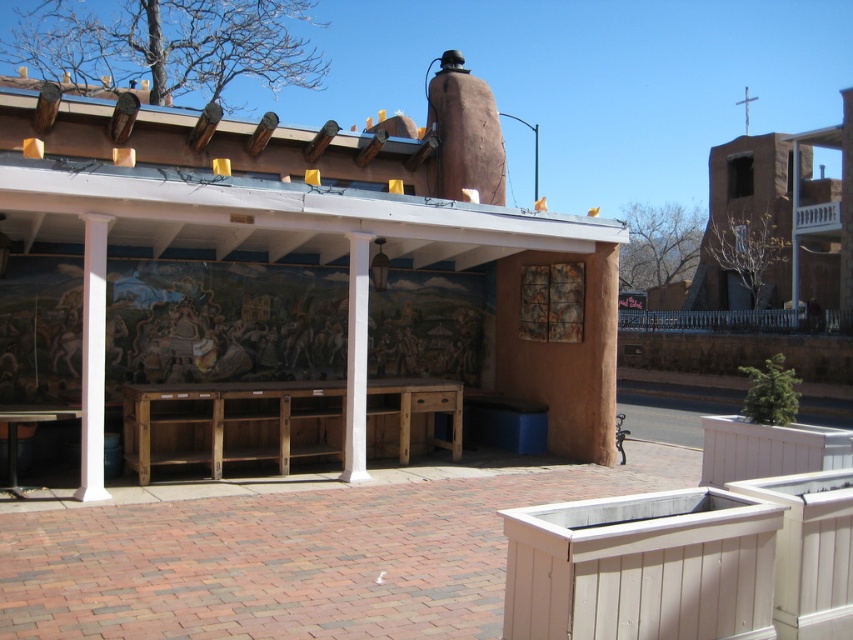
Is wooden bench at center to the right of wooden picnic table at lower left from the viewer's perspective?

Yes, wooden bench at center is to the right of wooden picnic table at lower left.

Which of these two, wooden bench at center or wooden picnic table at lower left, stands taller?

wooden picnic table at lower left is taller.

Between point (285, 272) and point (13, 436), which one is positioned in front?

Point (13, 436) is more forward.

The image size is (853, 640). In order to click on wooden bench at center in this screenshot , I will do `click(288, 288)`.